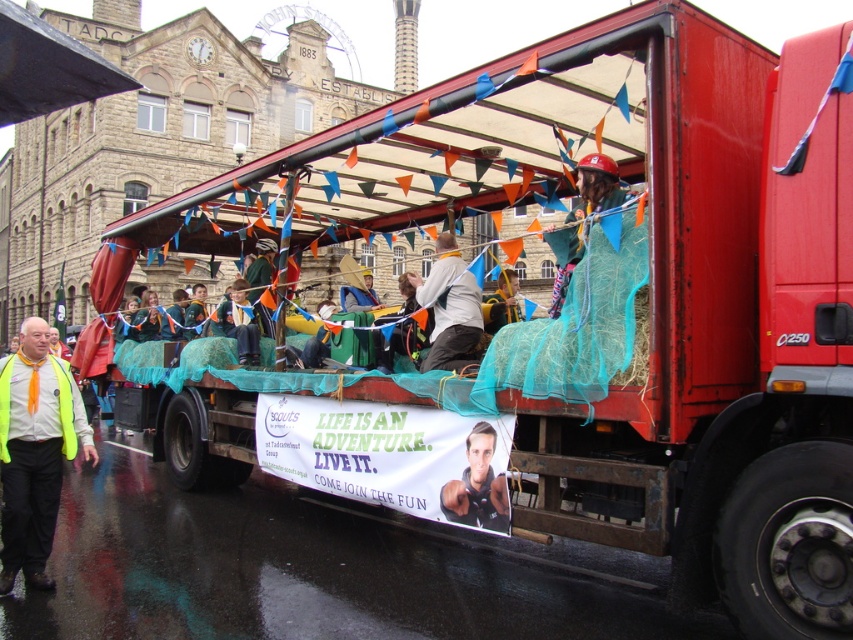
Can you confirm if blue fabric-covered figure at center is positioned to the right of matte green netting at center?

Incorrect, blue fabric-covered figure at center is not on the right side of matte green netting at center.

Does point (231, 292) lie in front of point (482, 301)?

No, it is behind (482, 301).

The width and height of the screenshot is (853, 640). What are the coordinates of `blue fabric-covered figure at center` in the screenshot? It's located at (239, 323).

In order to click on blue fabric-covered figure at center in this screenshot , I will do `click(239, 323)`.

Which is more to the left, neon yellow vest at left or green fabric-covered figure at center?

neon yellow vest at left

What do you see at coordinates (35, 451) in the screenshot?
I see `neon yellow vest at left` at bounding box center [35, 451].

Who is more distant from viewer, (26, 461) or (318, 333)?

Positioned behind is point (318, 333).

Where is `neon yellow vest at left`? neon yellow vest at left is located at coordinates (35, 451).

The image size is (853, 640). Find the location of `smooth skin portrait at center`. smooth skin portrait at center is located at coordinates (477, 484).